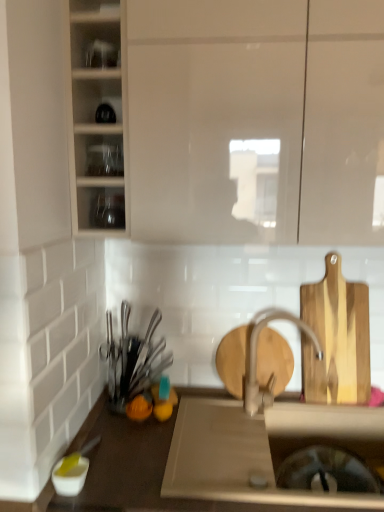
Question: Is the depth of matte white cabinet at upper left, positioned as the first cabinetry in left-to-right order, less than that of wooden cutting board at right?

Choices:
 (A) yes
 (B) no

Answer: (A)

Question: Considering the relative sizes of matte white cabinet at upper left, which appears as the second cabinetry when viewed from the right, and wooden cutting board at right in the image provided, is matte white cabinet at upper left, which appears as the second cabinetry when viewed from the right, wider than wooden cutting board at right?

Choices:
 (A) no
 (B) yes

Answer: (B)

Question: From a real-world perspective, is matte white cabinet at upper left, positioned as the first cabinetry in left-to-right order, over wooden cutting board at right?

Choices:
 (A) yes
 (B) no

Answer: (A)

Question: Is matte white cabinet at upper left, which appears as the second cabinetry when viewed from the right, next to wooden cutting board at right?

Choices:
 (A) yes
 (B) no

Answer: (B)

Question: Could you tell me if matte white cabinet at upper left, positioned as the first cabinetry in left-to-right order, is facing wooden cutting board at right?

Choices:
 (A) no
 (B) yes

Answer: (A)

Question: In terms of height, does matte white cabinet at upper center, the 1th cabinetry in the right-to-left sequence, look taller or shorter compared to wooden cutting board at right?

Choices:
 (A) tall
 (B) short

Answer: (A)

Question: Is matte white cabinet at upper center, the 1th cabinetry in the right-to-left sequence, wider or thinner than wooden cutting board at right?

Choices:
 (A) thin
 (B) wide

Answer: (B)

Question: Visually, is matte white cabinet at upper center, which appears as the 2th cabinetry when viewed from the left, positioned to the left or to the right of wooden cutting board at right?

Choices:
 (A) left
 (B) right

Answer: (A)

Question: Does point (347, 19) appear closer or farther from the camera than point (334, 314)?

Choices:
 (A) closer
 (B) farther

Answer: (A)

Question: From a real-world perspective, is white matte sink at center positioned above or below wooden cutting board at right?

Choices:
 (A) below
 (B) above

Answer: (A)

Question: In terms of height, does white matte sink at center look taller or shorter compared to wooden cutting board at right?

Choices:
 (A) tall
 (B) short

Answer: (B)

Question: Based on their sizes in the image, would you say white matte sink at center is bigger or smaller than wooden cutting board at right?

Choices:
 (A) big
 (B) small

Answer: (A)

Question: From the image's perspective, relative to wooden cutting board at right, is white matte sink at center above or below?

Choices:
 (A) above
 (B) below

Answer: (B)

Question: Would you say clear glass shelves at upper left, which appears as the 2th shelf when ordered from the bottom, is to the left or to the right of matte white cabinet at upper center, which appears as the 2th cabinetry when viewed from the left, in the picture?

Choices:
 (A) left
 (B) right

Answer: (A)

Question: From a real-world perspective, relative to matte white cabinet at upper center, the 1th cabinetry in the right-to-left sequence, is clear glass shelves at upper left, which appears as the 2th shelf when ordered from the bottom, vertically above or below?

Choices:
 (A) above
 (B) below

Answer: (B)